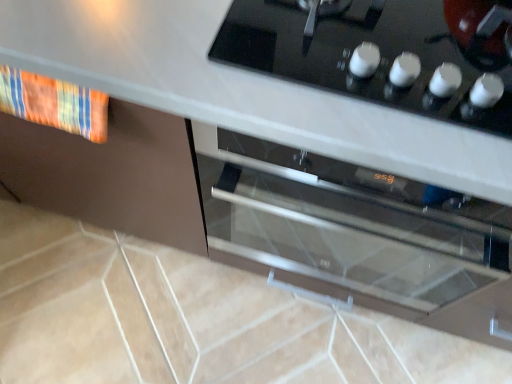
Question: Is satin silver oven at center bigger or smaller than textured fabric towel at left?

Choices:
 (A) small
 (B) big

Answer: (B)

Question: Is satin silver oven at center to the left or to the right of textured fabric towel at left in the image?

Choices:
 (A) right
 (B) left

Answer: (A)

Question: Which object is the closest to the black glass cooktop at upper center?

Choices:
 (A) satin silver oven at center
 (B) textured fabric towel at left

Answer: (A)

Question: Which object is the farthest from the black glass cooktop at upper center?

Choices:
 (A) textured fabric towel at left
 (B) satin silver oven at center

Answer: (A)